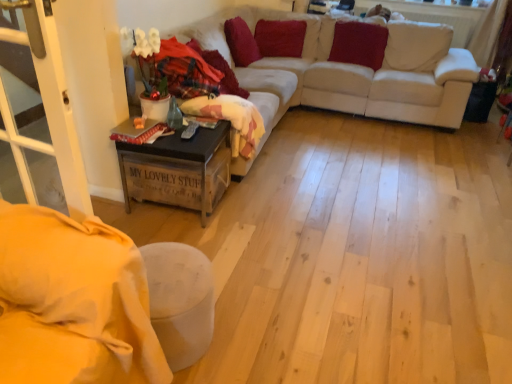
This screenshot has height=384, width=512. What are the coordinates of `free spot above wooden crate at lower left (from a real-world perspective)` in the screenshot? It's located at coord(165,127).